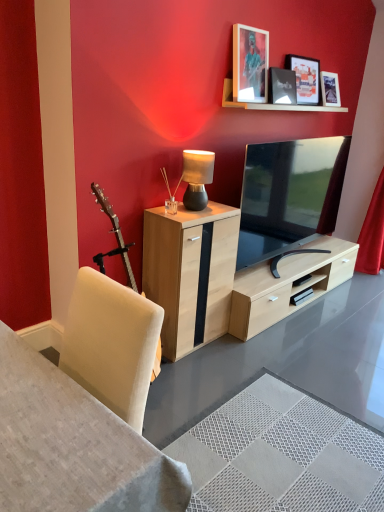
The image size is (384, 512). I want to click on vacant space in front of matte black table lamp at center, so click(192, 212).